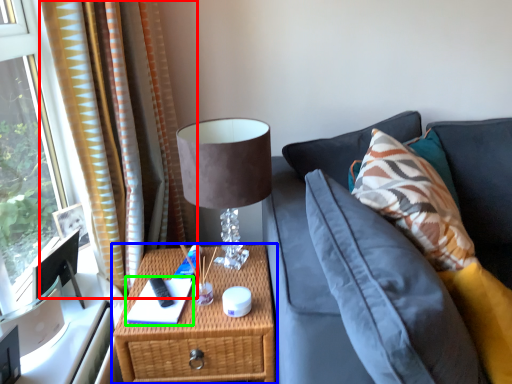
Question: Based on their relative distances, which object is nearer to curtain (highlighted by a red box)? Choose from nightstand (highlighted by a blue box) and book (highlighted by a green box).

Choices:
 (A) nightstand
 (B) book

Answer: (A)